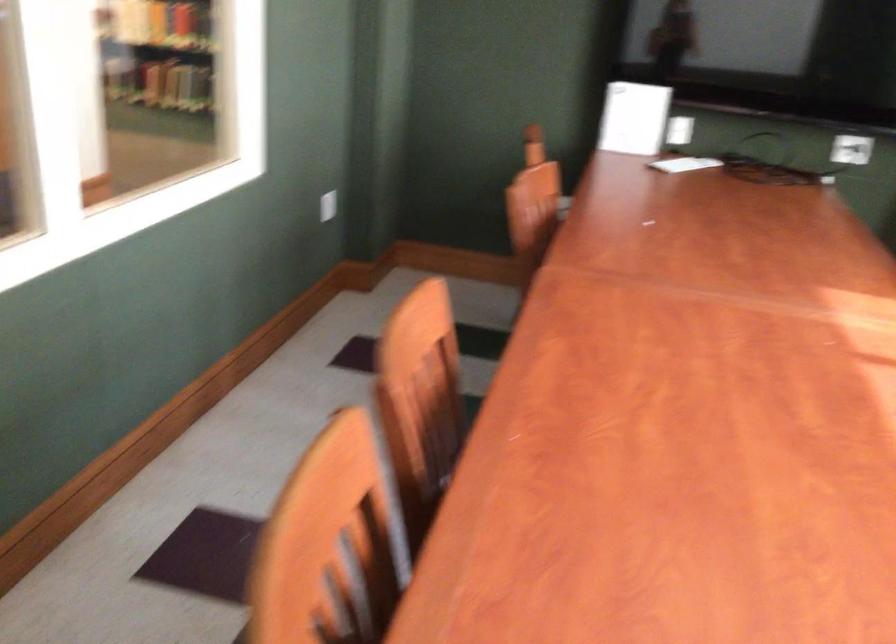
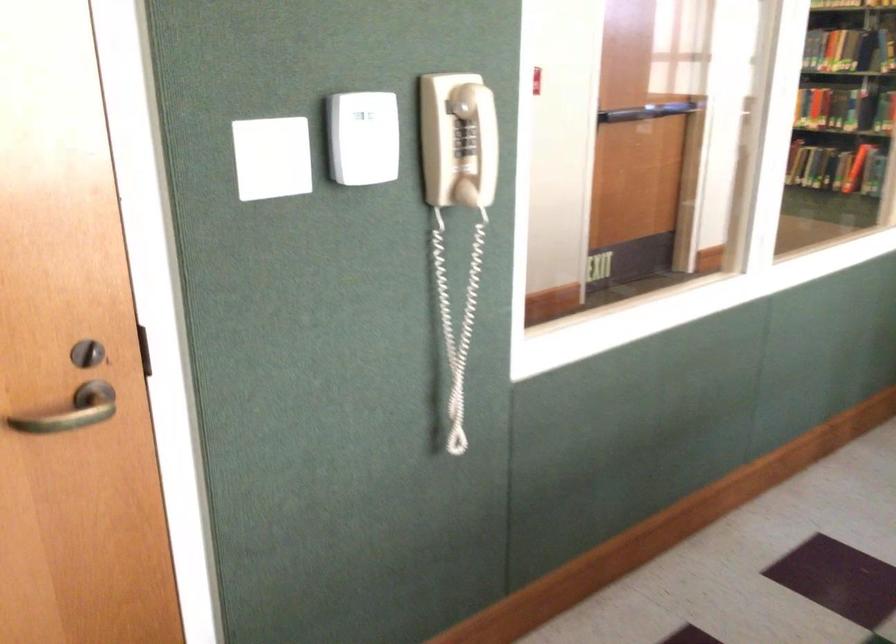
Question: The camera is either moving clockwise (left) or counter-clockwise (right) around the object. The first image is from the beginning of the video and the second image is from the end. Is the camera moving left or right when shooting the video?

Choices:
 (A) Left
 (B) Right

Answer: (B)